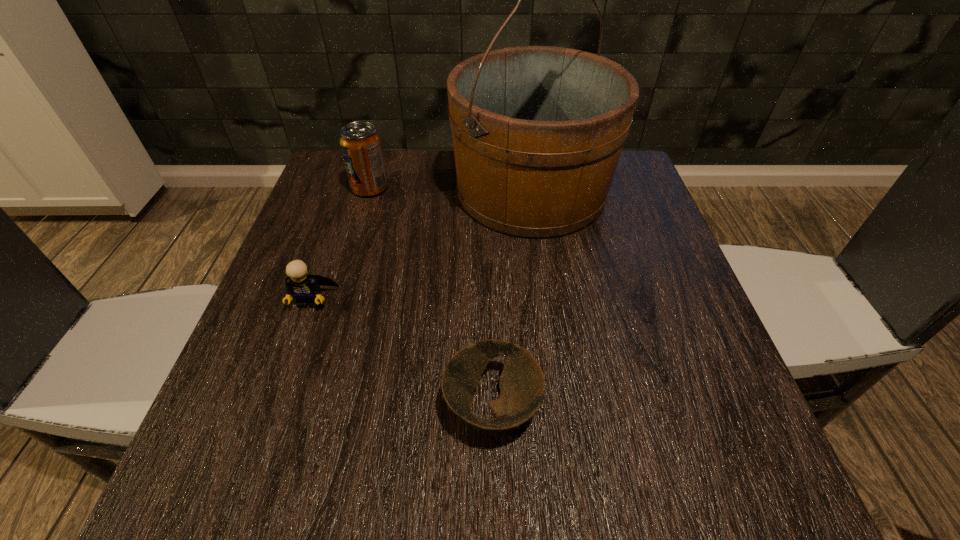
Where is `vacant point located between the tallest object and the third tallest object`? This screenshot has width=960, height=540. vacant point located between the tallest object and the third tallest object is located at coordinates (421, 246).

Point out which object is positioned as the nearest to the shortest object. Please provide its 2D coordinates. Your answer should be formatted as a tuple, i.e. [(x, y)], where the tuple contains the x and y coordinates of a point satisfying the conditions above.

[(305, 288)]

This screenshot has width=960, height=540. Identify the location of object that ranks as the second closest to the third farthest object. (538, 131).

Where is `vacant space that satisfies the following two spatial constraints: 1. on the front-facing side of the third farthest object; 2. on the right side of the shortest object`? This screenshot has height=540, width=960. vacant space that satisfies the following two spatial constraints: 1. on the front-facing side of the third farthest object; 2. on the right side of the shortest object is located at coordinates (274, 406).

Locate an element on the screen. The height and width of the screenshot is (540, 960). vacant space that satisfies the following two spatial constraints: 1. on the front-facing side of the third tallest object; 2. on the right side of the nearest object is located at coordinates (274, 406).

Where is `free space that satisfies the following two spatial constraints: 1. on the front-facing side of the third tallest object; 2. on the right side of the shortest object`? This screenshot has height=540, width=960. free space that satisfies the following two spatial constraints: 1. on the front-facing side of the third tallest object; 2. on the right side of the shortest object is located at coordinates (274, 406).